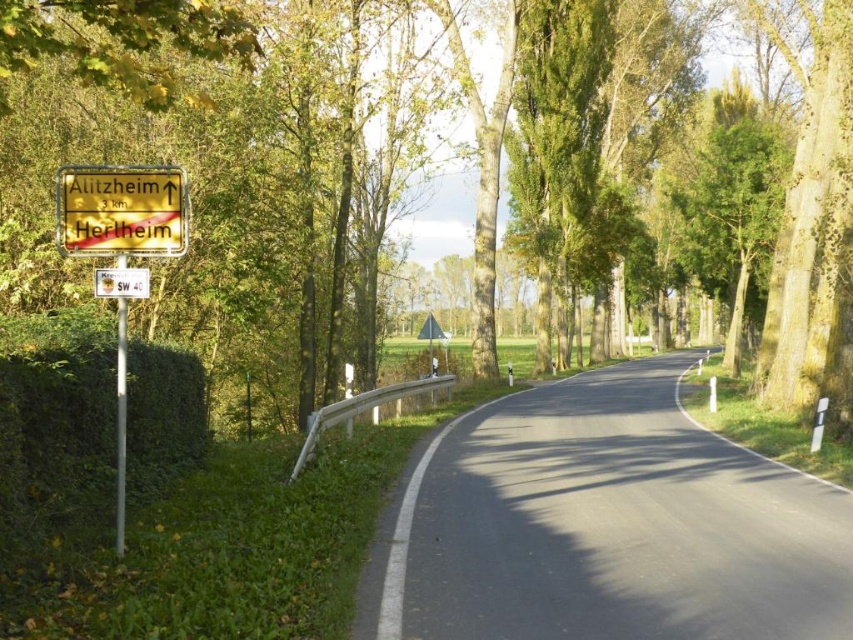
You are driving a car and see the yellow metallic sign at left and the yellow wooden sign at left while approaching the road. Which sign is positioned lower on the road side?

The yellow metallic sign at left is located below the yellow wooden sign at left, so it is positioned lower on the road side.

Looking at this image, you are standing at the center of the road in the image. Which direction should you look to see the green leafy hedge at left?

The green leafy hedge at left is located at the left side of the road, so you should look to your left to see it.

You are driving along the rural road and see two points marked on your GPS. The first point is at coordinate point (99, 225) and the second is at point (125, 193). If you are facing the direction of the road, which point is closer to you?

Point (99, 225) is in front of point (125, 193), so the first point is closer to you.